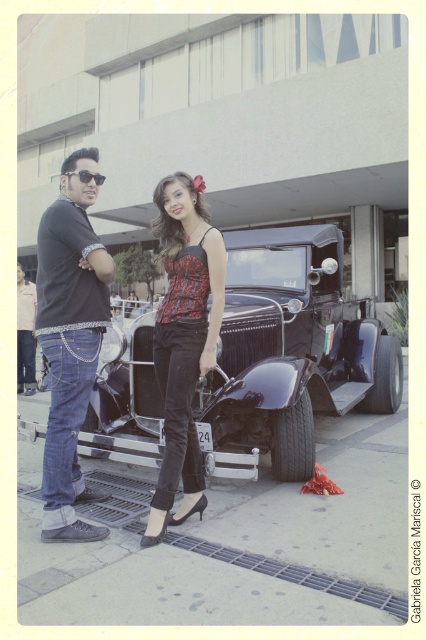
Does shiny black car at center appear on the left side of matte black shirt at center?

Incorrect, shiny black car at center is not on the left side of matte black shirt at center.

Does shiny black car at center have a greater height compared to matte black shirt at center?

In fact, shiny black car at center may be shorter than matte black shirt at center.

Does point (347, 316) lie in front of point (83, 211)?

No, (347, 316) is behind (83, 211).

This screenshot has height=640, width=426. I want to click on shiny black car at center, so click(x=291, y=352).

Which is above, shiny black car at center or matte black top at center?

Positioned higher is shiny black car at center.

Between point (112, 433) and point (181, 280), which one is positioned behind?

Point (112, 433)

Which is behind, point (347, 333) or point (187, 220)?

Point (347, 333)

Find the location of a particular element. The width and height of the screenshot is (426, 640). shiny black car at center is located at coordinates (291, 352).

Is denim jeans at left above matte black top at center?

Yes.

Between point (85, 378) and point (172, 186), which one is positioned in front?

Point (85, 378) is more forward.

Where is `denim jeans at left`? The image size is (426, 640). denim jeans at left is located at coordinates (69, 340).